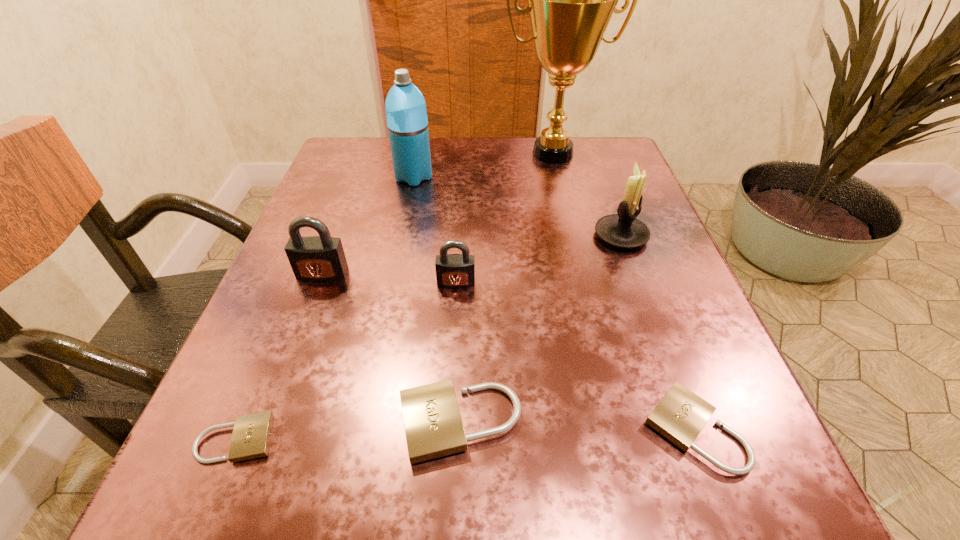
You are a GUI agent. You are given a task and a screenshot of the screen. Output one action in this format:
    pyautogui.click(x=<x>, y=<y>)
    Task: Click on the empty location between the leftmost beige padlock and the right gray padlock
    
    Given the screenshot: What is the action you would take?
    (347, 361)

Find the location of a particular element. Image resolution: width=960 pixels, height=540 pixels. vacant area that lies between the second beige padlock from left to right and the fourth tallest object is located at coordinates (391, 348).

I want to click on the fourth closest object to the second beige padlock from right to left, so click(321, 258).

Identify which object is the nearest to the second beige padlock from right to left. Please provide its 2D coordinates. Your answer should be formatted as a tuple, i.e. [(x, y)], where the tuple contains the x and y coordinates of a point satisfying the conditions above.

[(251, 436)]

Point out which padlock is positioned as the fourth nearest to the tallest padlock. Please provide its 2D coordinates. Your answer should be formatted as a tuple, i.e. [(x, y)], where the tuple contains the x and y coordinates of a point satisfying the conditions above.

[(680, 415)]

I want to click on padlock object that ranks as the third closest to the second tallest padlock, so click(680, 415).

Find the location of `the third closest beige padlock relative to the tallest padlock`. the third closest beige padlock relative to the tallest padlock is located at coordinates [680, 415].

Point out which beige padlock is positioned as the third nearest to the fourth tallest object. Please provide its 2D coordinates. Your answer should be formatted as a tuple, i.e. [(x, y)], where the tuple contains the x and y coordinates of a point satisfying the conditions above.

[(680, 415)]

Find the location of a particular element. This screenshot has width=960, height=540. vacant position in the image that satisfies the following two spatial constraints: 1. on the front side of the thermos bottle; 2. on the right side of the third tallest object is located at coordinates (402, 236).

Image resolution: width=960 pixels, height=540 pixels. Find the location of `vacant region that satisfies the following two spatial constraints: 1. on the front of the fourth tallest padlock near the keyhole; 2. on the left side of the tallest padlock`. vacant region that satisfies the following two spatial constraints: 1. on the front of the fourth tallest padlock near the keyhole; 2. on the left side of the tallest padlock is located at coordinates (264, 429).